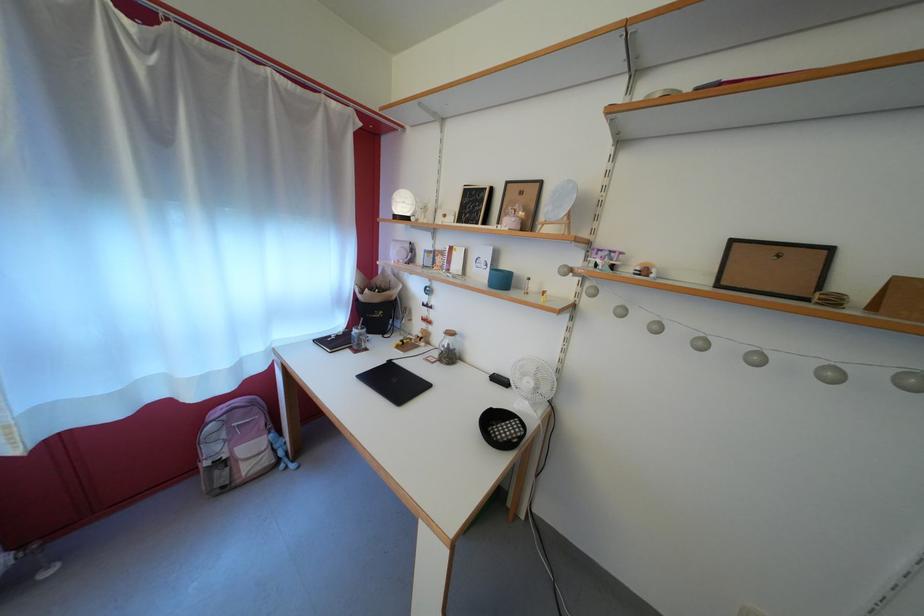
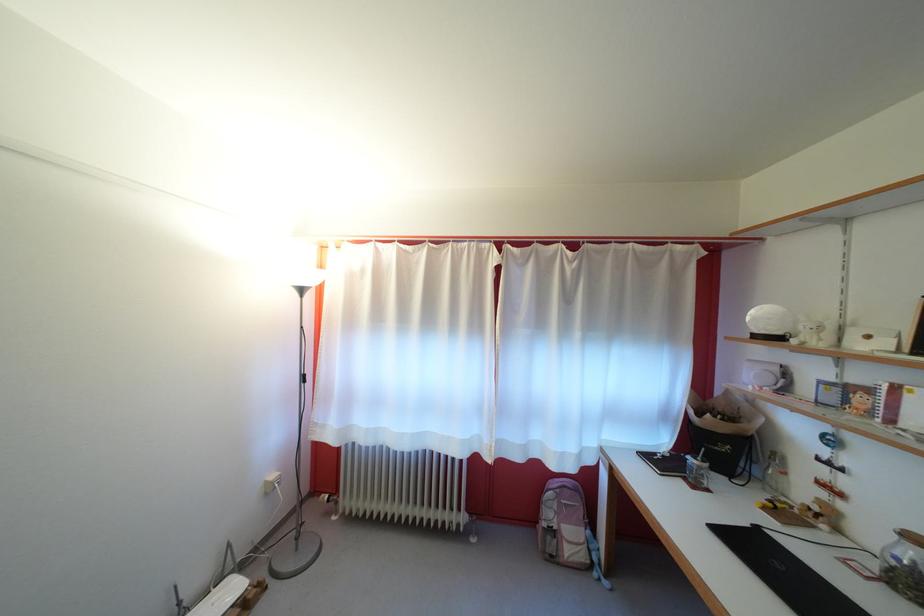
In the second image, find the point that corresponds to (x=223, y=456) in the first image.

(556, 521)